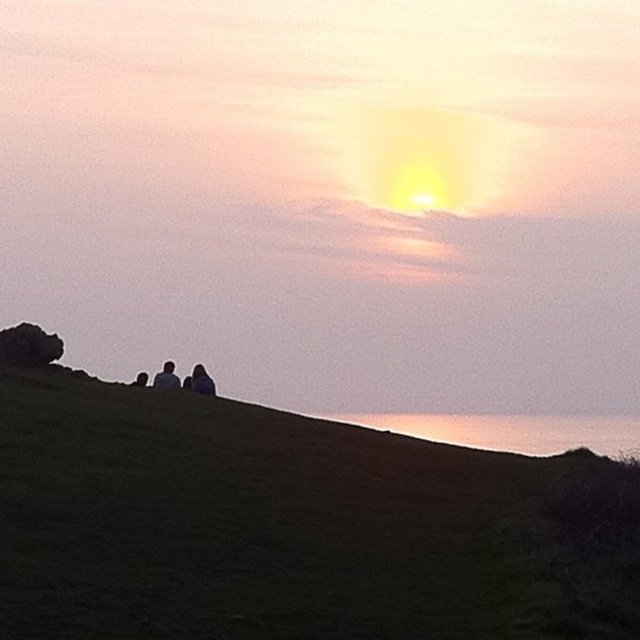
Is point (163, 371) positioned behind point (141, 385)?

Yes, it is behind point (141, 385).

Is dark gray sweater at center to the right of silhouette figure at center from the viewer's perspective?

Correct, you'll find dark gray sweater at center to the right of silhouette figure at center.

This screenshot has width=640, height=640. What do you see at coordinates (166, 378) in the screenshot?
I see `dark gray sweater at center` at bounding box center [166, 378].

This screenshot has height=640, width=640. I want to click on dark gray sweater at center, so click(166, 378).

Between dark blue fabric at center and dark gray sweater at center, which one is positioned lower?

Positioned lower is dark blue fabric at center.

From the picture: Is dark blue fabric at center bigger than dark gray sweater at center?

Incorrect, dark blue fabric at center is not larger than dark gray sweater at center.

Who is more distant from viewer, (202, 372) or (168, 371)?

Positioned behind is point (168, 371).

At what (x,y) coordinates should I click in order to perform the action: click on dark blue fabric at center. Please return your answer as a coordinate pair (x, y). Image resolution: width=640 pixels, height=640 pixels. Looking at the image, I should click on (202, 381).

Which is in front, point (200, 371) or point (136, 385)?

Positioned in front is point (136, 385).

Who is positioned more to the left, dark blue fabric at center or silhouette figure at center?

From the viewer's perspective, silhouette figure at center appears more on the left side.

Locate an element on the screen. This screenshot has width=640, height=640. dark blue fabric at center is located at coordinates (202, 381).